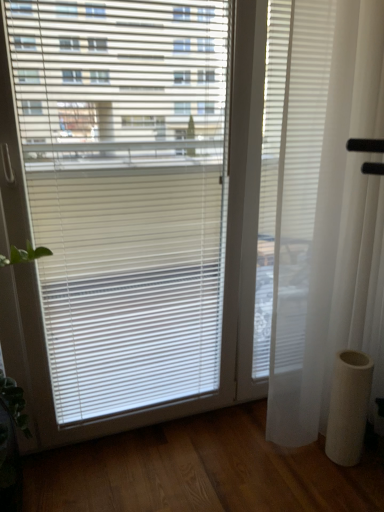
You are a GUI agent. You are given a task and a screenshot of the screen. Output one action in this format:
    pyautogui.click(x=<x>, y=<y>)
    Task: Click on the vacant space that is to the left of white matte cylinder at lower right
    Image resolution: width=384 pixels, height=512 pixels.
    Given the screenshot: What is the action you would take?
    pyautogui.click(x=304, y=462)